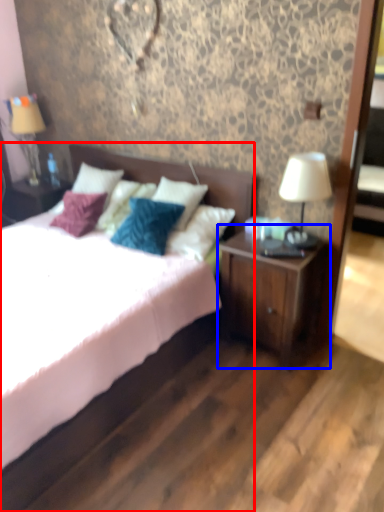
Question: Which of the following is the closest to the observer, bed (highlighted by a red box) or nightstand (highlighted by a blue box)?

Choices:
 (A) bed
 (B) nightstand

Answer: (A)